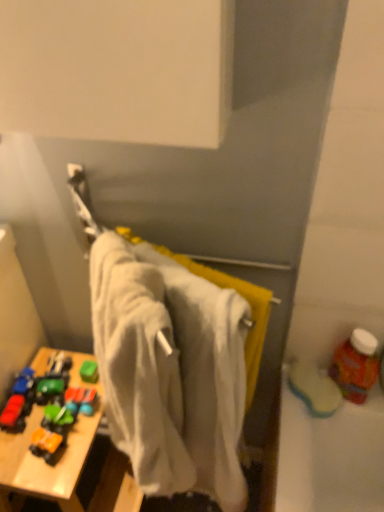
Question: From the image's perspective, is white cotton towel at center located beneath rubberized plastic toy car at lower left?

Choices:
 (A) yes
 (B) no

Answer: (B)

Question: Considering the relative sizes of white cotton towel at center and rubberized plastic toy car at lower left in the image provided, is white cotton towel at center wider than rubberized plastic toy car at lower left?

Choices:
 (A) yes
 (B) no

Answer: (A)

Question: Is white cotton towel at center thinner than rubberized plastic toy car at lower left?

Choices:
 (A) yes
 (B) no

Answer: (B)

Question: Is white cotton towel at center surrounding rubberized plastic toy car at lower left?

Choices:
 (A) no
 (B) yes

Answer: (A)

Question: Can you confirm if white cotton towel at center is positioned to the left of rubberized plastic toy car at lower left?

Choices:
 (A) no
 (B) yes

Answer: (A)

Question: Could you tell me if white cotton towel at center is turned towards rubberized plastic toy car at lower left?

Choices:
 (A) no
 (B) yes

Answer: (A)

Question: Does rubberized plastic toy car at lower left turn towards wooden toy at lower left?

Choices:
 (A) no
 (B) yes

Answer: (B)

Question: Can you confirm if rubberized plastic toy car at lower left is thinner than wooden toy at lower left?

Choices:
 (A) no
 (B) yes

Answer: (B)

Question: Does rubberized plastic toy car at lower left appear on the left side of wooden toy at lower left?

Choices:
 (A) yes
 (B) no

Answer: (A)

Question: Considering the relative sizes of rubberized plastic toy car at lower left and wooden toy at lower left in the image provided, is rubberized plastic toy car at lower left smaller than wooden toy at lower left?

Choices:
 (A) no
 (B) yes

Answer: (B)

Question: Is rubberized plastic toy car at lower left positioned in front of wooden toy at lower left?

Choices:
 (A) no
 (B) yes

Answer: (A)

Question: Can you confirm if rubberized plastic toy car at lower left is taller than wooden toy at lower left?

Choices:
 (A) yes
 (B) no

Answer: (B)

Question: Are rubberized plastic toy car at lower left and translucent plastic bottle at right located far from each other?

Choices:
 (A) no
 (B) yes

Answer: (A)